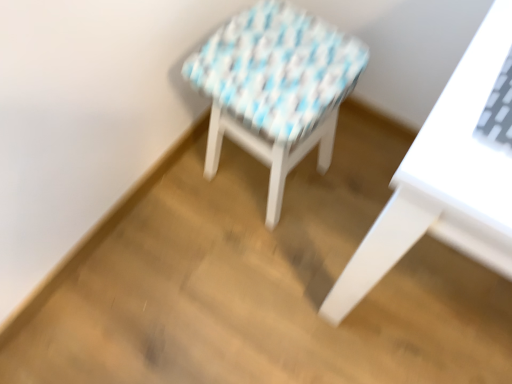
Locate an element on the screen. vacant area situated below white woven stool at center (from a real-world perspective) is located at coordinates (258, 179).